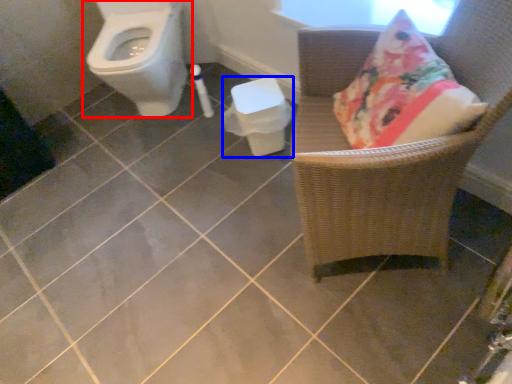
Question: Which of the following is the farthest to the observer, toilet (highlighted by a red box) or potty (highlighted by a blue box)?

Choices:
 (A) toilet
 (B) potty

Answer: (B)